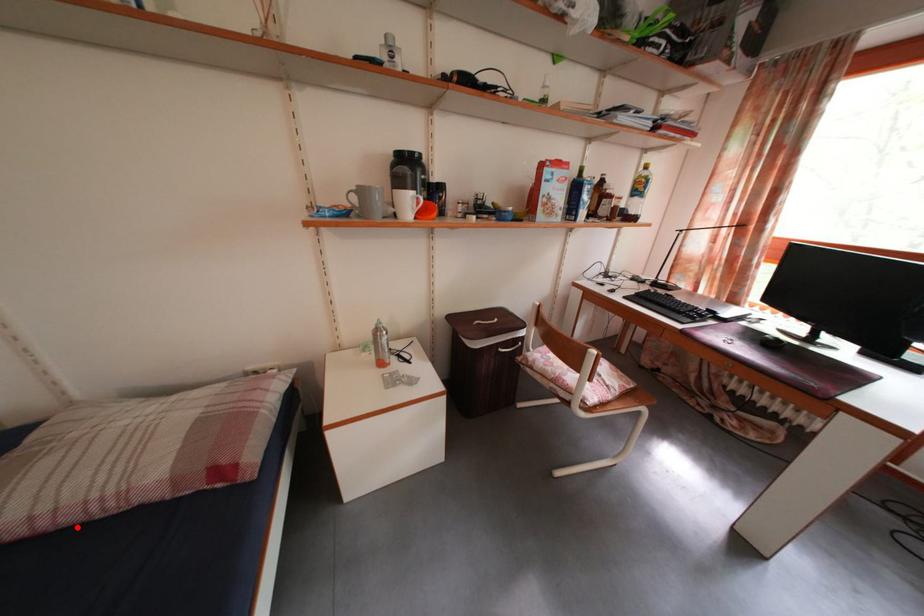
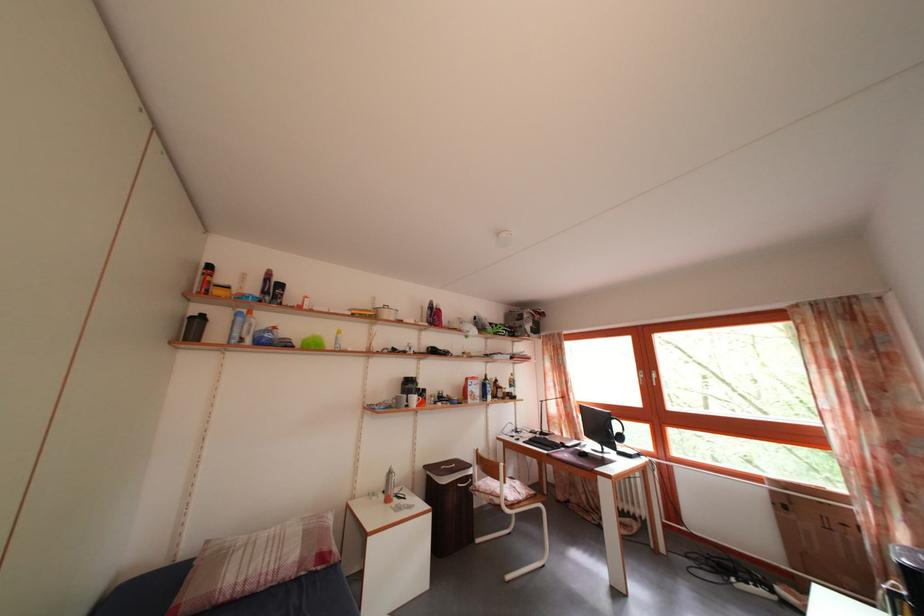
The point at the highlighted location is marked in the first image. Where is the corresponding point in the second image?

(257, 594)